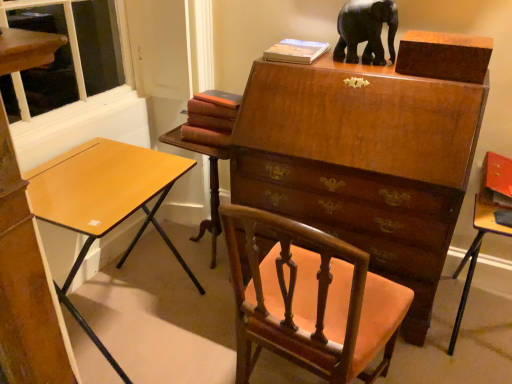
At what (x,y) coordinates should I click in order to perform the action: click on vacant area situated below mahogany wood table at center, which appears as the 2th table when viewed from the right (from a real-world perspective). Please return your answer as a coordinate pair (x, y). The image size is (512, 384). Looking at the image, I should click on (203, 256).